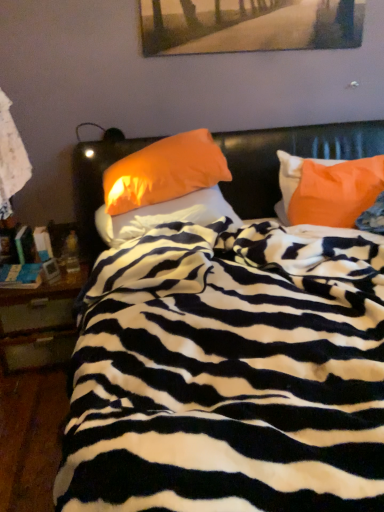
Question: Is wooden nightstand at left in front of orange fabric pillow at center, which appears as the 2th pillow when viewed from the left?

Choices:
 (A) yes
 (B) no

Answer: (B)

Question: From the image's perspective, is wooden nightstand at left on top of orange fabric pillow at center, which appears as the 2th pillow when viewed from the left?

Choices:
 (A) no
 (B) yes

Answer: (A)

Question: Can you confirm if wooden nightstand at left is shorter than orange fabric pillow at center, the 2th pillow in the right-to-left sequence?

Choices:
 (A) yes
 (B) no

Answer: (B)

Question: Does wooden nightstand at left come behind orange fabric pillow at center, which appears as the 2th pillow when viewed from the left?

Choices:
 (A) yes
 (B) no

Answer: (A)

Question: From a real-world perspective, is wooden nightstand at left located beneath orange fabric pillow at center, the 2th pillow in the right-to-left sequence?

Choices:
 (A) no
 (B) yes

Answer: (B)

Question: Can you confirm if wooden nightstand at left is positioned to the right of orange fabric pillow at center, which appears as the 2th pillow when viewed from the left?

Choices:
 (A) yes
 (B) no

Answer: (B)

Question: Is wooden nightstand at left outside of zebra-patterned blanket at center?

Choices:
 (A) no
 (B) yes

Answer: (B)

Question: From the image's perspective, is wooden nightstand at left located above zebra-patterned blanket at center?

Choices:
 (A) no
 (B) yes

Answer: (A)

Question: Is wooden nightstand at left surrounding zebra-patterned blanket at center?

Choices:
 (A) no
 (B) yes

Answer: (A)

Question: Considering the relative sizes of wooden nightstand at left and zebra-patterned blanket at center in the image provided, is wooden nightstand at left shorter than zebra-patterned blanket at center?

Choices:
 (A) no
 (B) yes

Answer: (B)

Question: Considering the relative positions of wooden nightstand at left and zebra-patterned blanket at center in the image provided, is wooden nightstand at left to the right of zebra-patterned blanket at center from the viewer's perspective?

Choices:
 (A) no
 (B) yes

Answer: (A)

Question: Does wooden nightstand at left have a greater width compared to zebra-patterned blanket at center?

Choices:
 (A) no
 (B) yes

Answer: (A)

Question: Considering the relative sizes of orange fabric pillow at center, the 2th pillow in the right-to-left sequence, and orange fabric pillow at center, marked as the 3th pillow in a right-to-left arrangement, in the image provided, is orange fabric pillow at center, the 2th pillow in the right-to-left sequence, wider than orange fabric pillow at center, marked as the 3th pillow in a right-to-left arrangement,?

Choices:
 (A) yes
 (B) no

Answer: (B)